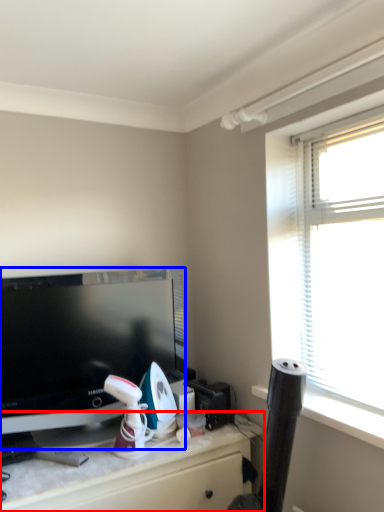
Question: Which object is closer to the camera taking this photo, desk (highlighted by a red box) or television (highlighted by a blue box)?

Choices:
 (A) desk
 (B) television

Answer: (A)